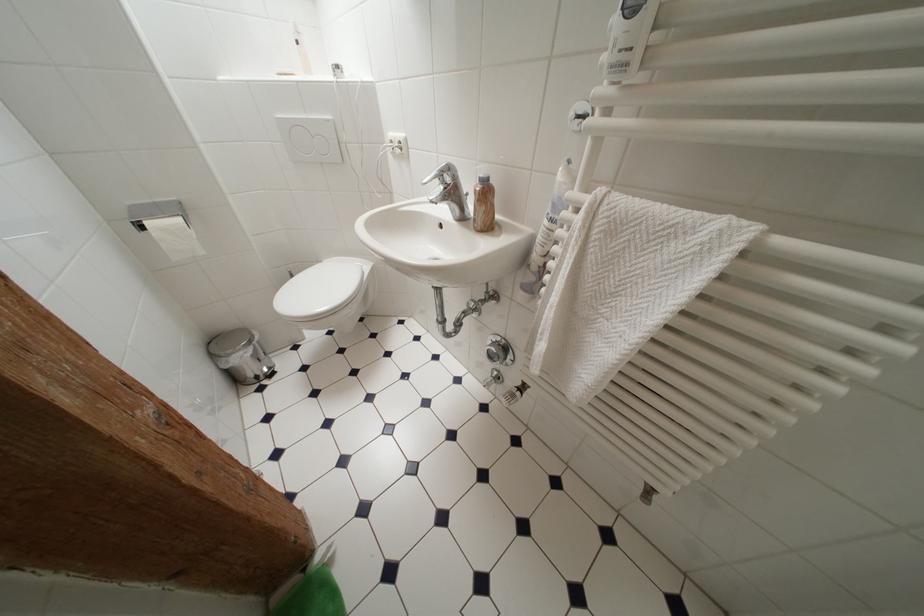
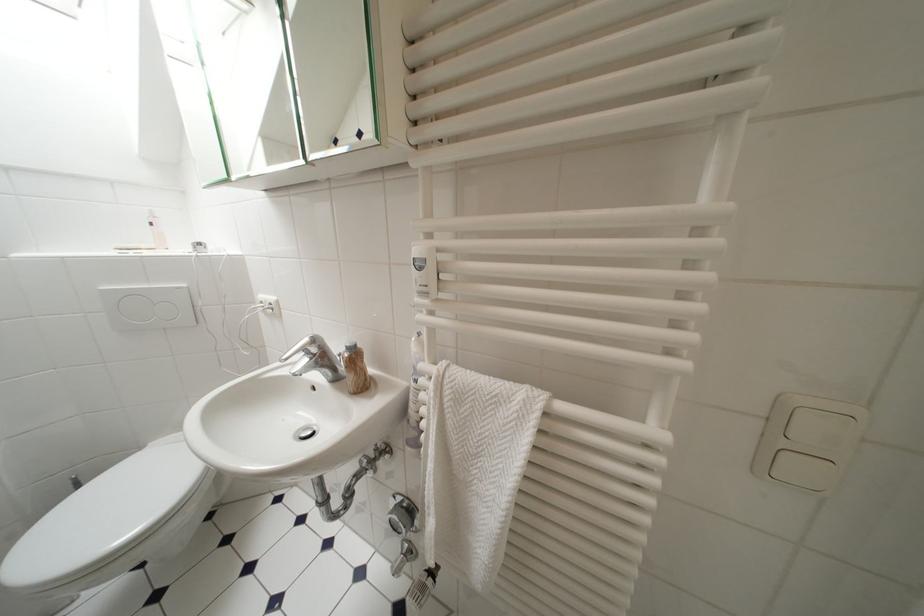
Locate, in the second image, the point that corresponds to [304,46] in the first image.

(159, 227)